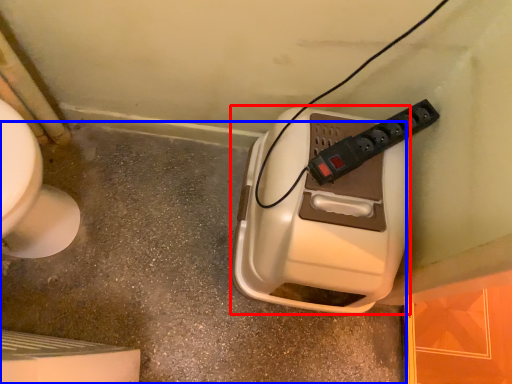
Question: Which object is closer to the camera taking this photo, hand dryer (highlighted by a red box) or concrete (highlighted by a blue box)?

Choices:
 (A) hand dryer
 (B) concrete

Answer: (A)